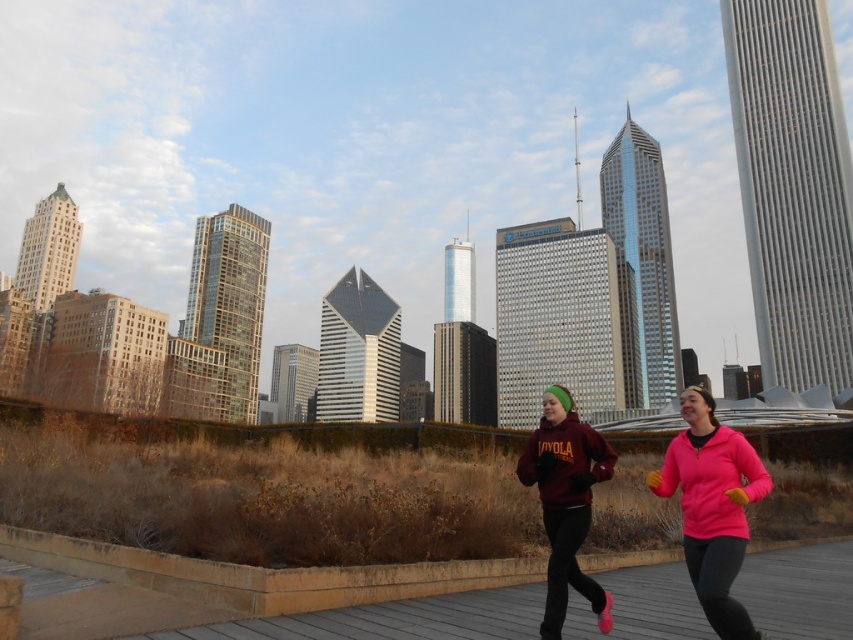
You are a drone operator trying to capture a photo of two points in the city scene. The first point is at coordinates point (718, 467) and the second is at point (593, 477). Since you want to ensure both are in focus, which point should you focus on to capture both clearly?

You should focus on point (718, 467) because it is closer to the camera than point (593, 477), allowing the second point to be in focus as well due to depth of field.

You are a photographer trying to capture the city skyline in the background. You see the wooden deck at center and the pink fleece at center in the foreground. Which object should you move closer to in order to block the skyline less?

The pink fleece at center is behind the wooden deck at center, so moving closer to the wooden deck at center would place it between you and the skyline, thus blocking less of the skyline compared to the pink fleece at center.